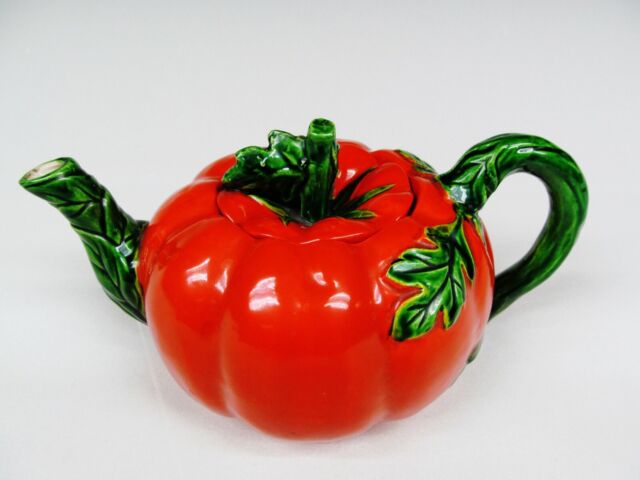
This screenshot has height=480, width=640. I want to click on tea pot top, so click(x=266, y=222).